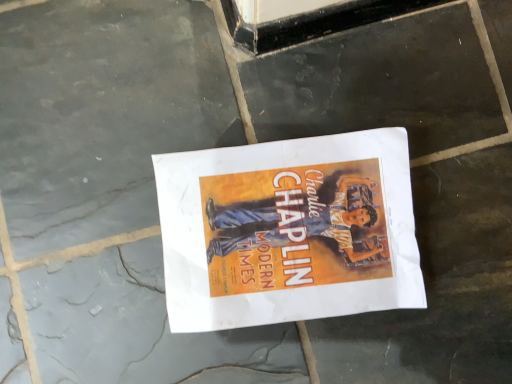
Identify the location of vacant space situated above white paper poster at center (from a real-world perspective). This screenshot has width=512, height=384. (287, 227).